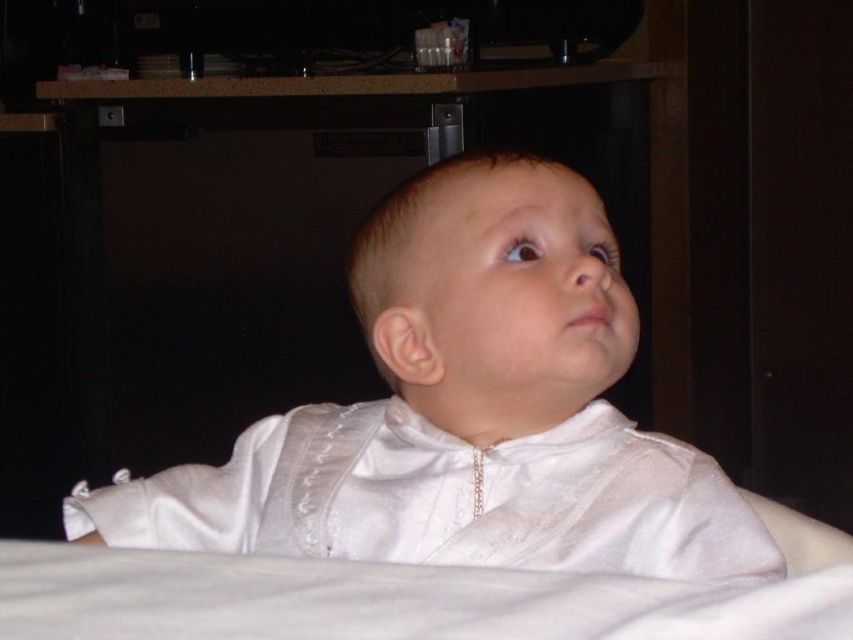
You are a photographer setting up a shoot with a baby. You notice the white satin baby at center and the white satin robe at center in the image. Which object is positioned higher in the scene?

The white satin baby at center is located above the white satin robe at center, so the baby is positioned higher.

You are a photographer setting up for a baby photoshoot. You have a white satin robe at center and a white satin baby at center in the frame. Which object should you adjust to ensure the baby is the main focus? Explain your reasoning.

The white satin baby at center is much taller than the white satin robe at center. To ensure the baby is the main focus, adjust the robe to position it lower or smaller in the frame so the baby remains the dominant subject.

You are a photographer setting up for a baby photoshoot. The scene has a white satin baby at center and a white satin robe at center. Which object is wider?

The white satin baby at center is wider than the white satin robe at center.